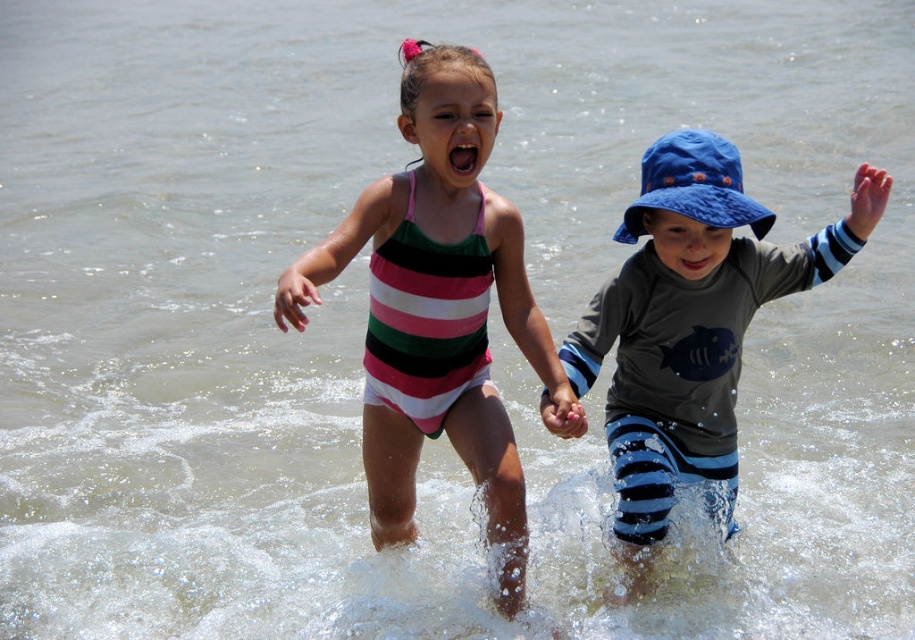
Between striped fabric swimsuit at center and blue striped shorts at center, which one appears on the right side from the viewer's perspective?

Positioned to the right is blue striped shorts at center.

Is point (544, 337) behind point (643, 323)?

No.

Is point (458, 291) behind point (716, 300)?

No, (458, 291) is closer to viewer.

You are a GUI agent. You are given a task and a screenshot of the screen. Output one action in this format:
    pyautogui.click(x=<x>, y=<y>)
    Task: Click on the striped fabric swimsuit at center
    This screenshot has width=915, height=640.
    Given the screenshot: What is the action you would take?
    pyautogui.click(x=438, y=307)